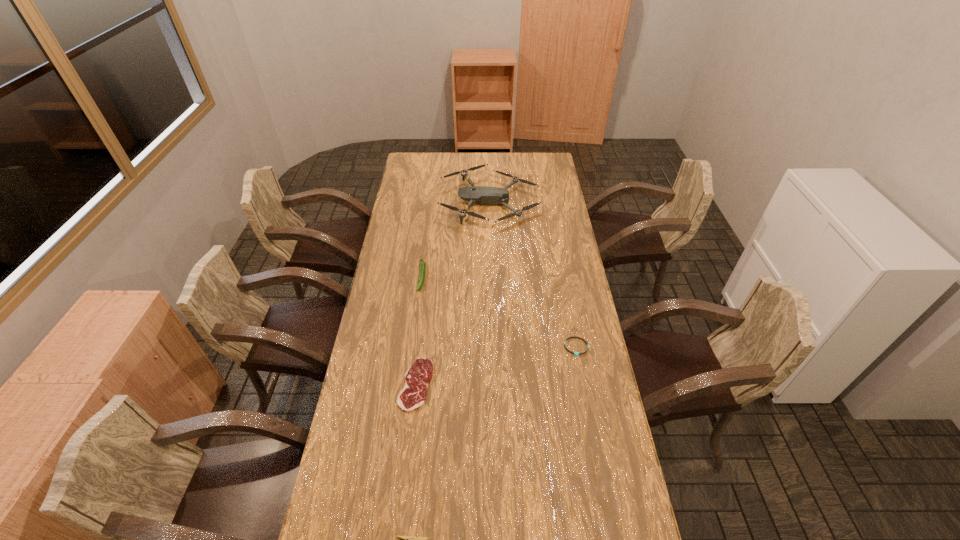
Where is `object that is the second closest to the nearest object`? The width and height of the screenshot is (960, 540). object that is the second closest to the nearest object is located at coordinates (575, 353).

Where is `object that is the fourth closest to the farthest object`? object that is the fourth closest to the farthest object is located at coordinates (407, 539).

Identify the location of vacant area that satisfies the following two spatial constraints: 1. with a camera mounted on the front of the drone; 2. on the front-facing side of the fourth nearest object. [x=492, y=276].

You are a GUI agent. You are given a task and a screenshot of the screen. Output one action in this format:
    pyautogui.click(x=<x>, y=<y>)
    Task: Click on the free space in the image that satisfies the following two spatial constraints: 1. on the front-facing side of the steak; 2. on the right side of the second tallest object
    
    Given the screenshot: What is the action you would take?
    pyautogui.click(x=408, y=384)